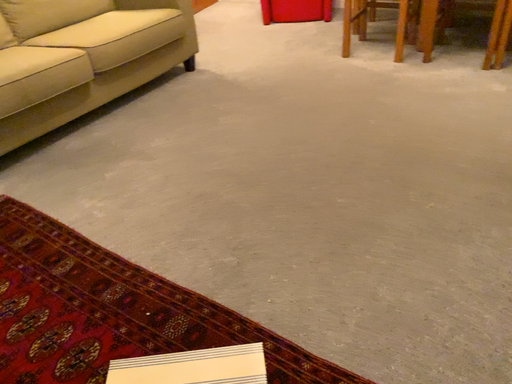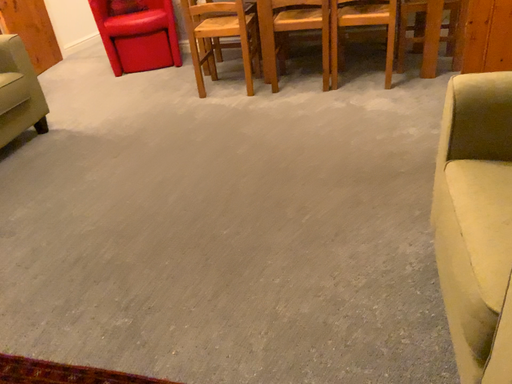
Question: How did the camera likely rotate when shooting the video?

Choices:
 (A) rotated downward
 (B) rotated upward

Answer: (B)